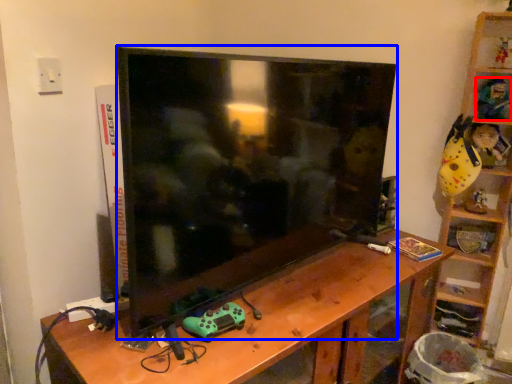
Question: Which object is further to the camera taking this photo, toy (highlighted by a red box) or television (highlighted by a blue box)?

Choices:
 (A) toy
 (B) television

Answer: (A)